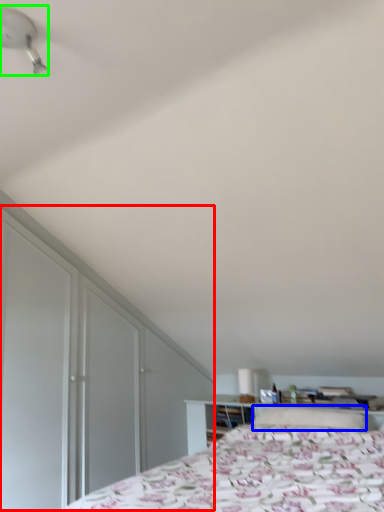
Question: Considering the real-world distances, which object is closest to dresser (highlighted by a red box)? pillow (highlighted by a blue box) or fan (highlighted by a green box).

Choices:
 (A) pillow
 (B) fan

Answer: (A)